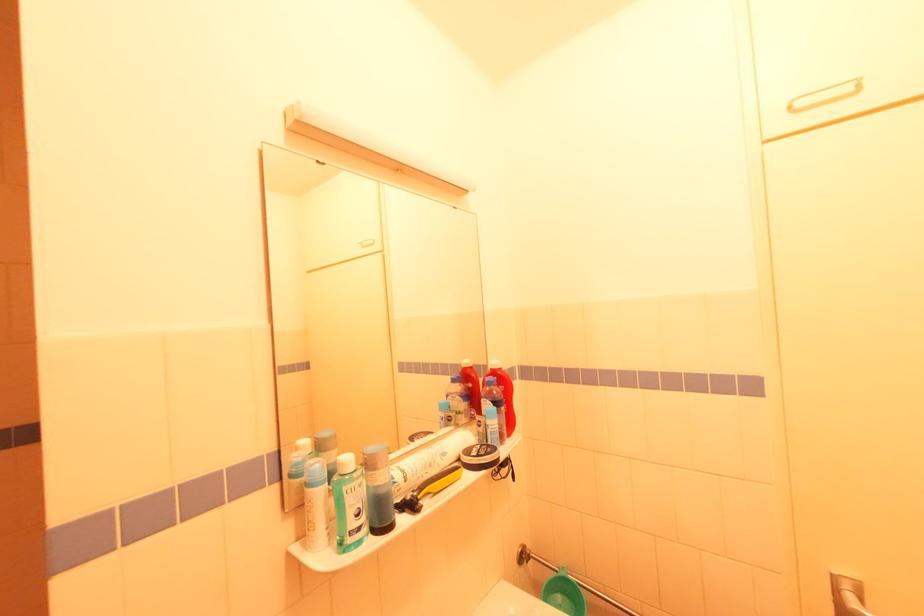
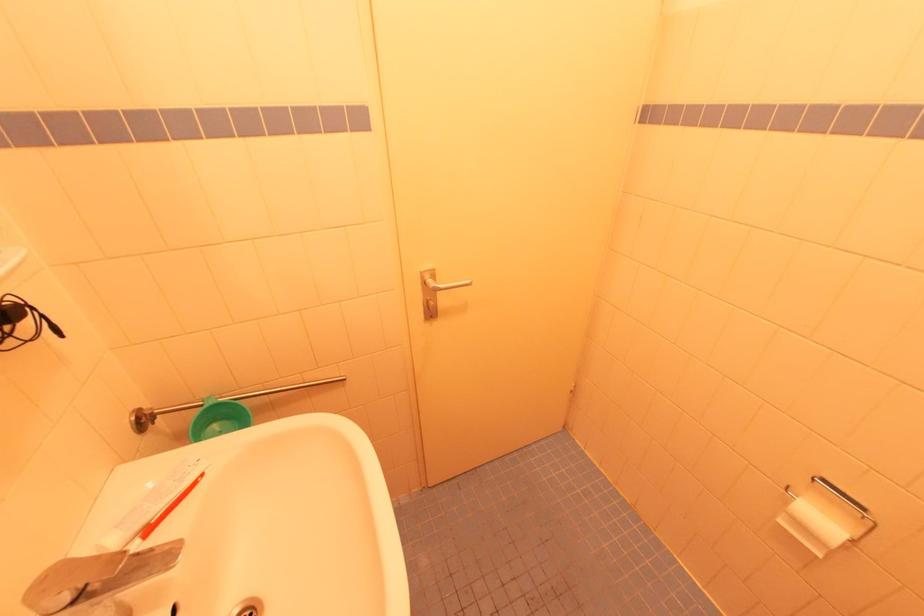
The images are taken continuously from a first-person perspective. In which direction is your viewpoint rotating?

The camera's rotation is toward right-down.